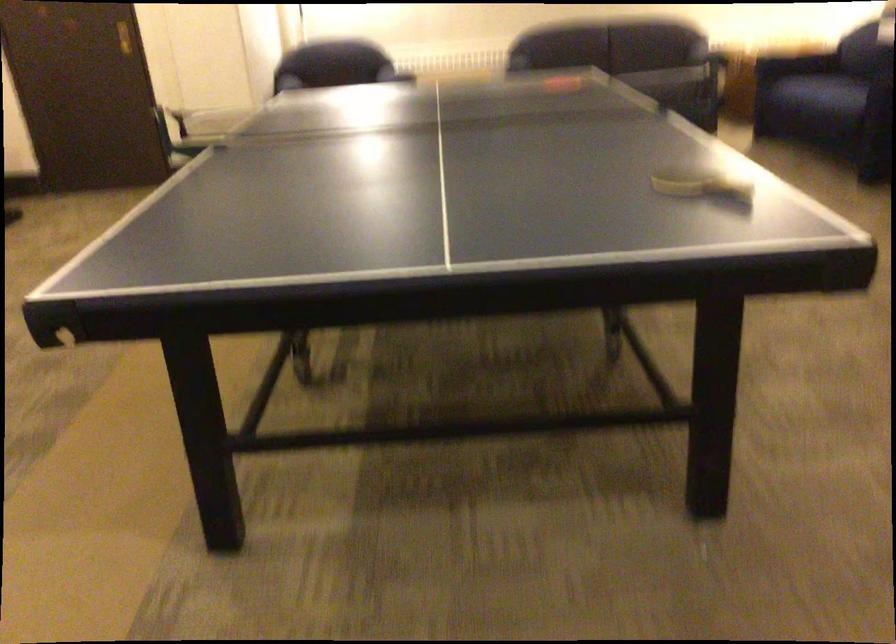
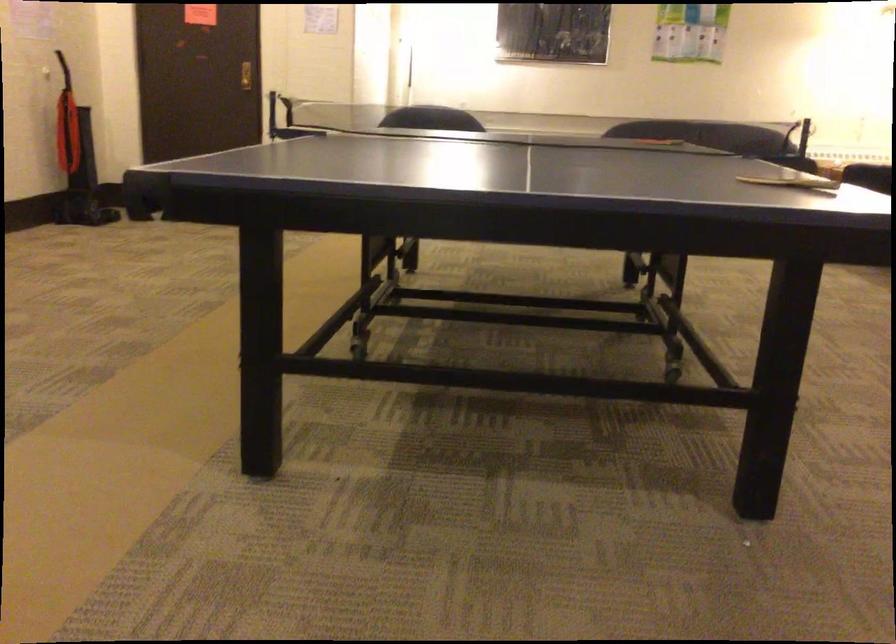
The images are taken continuously from a first-person perspective. In which direction are you moving?

The movement direction of the cameraman is right, forward.